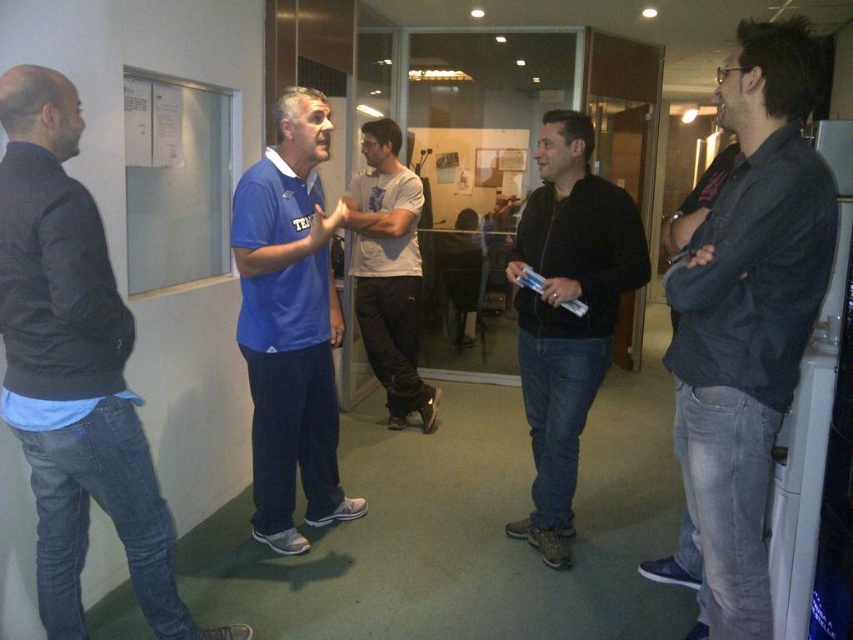
Who is more forward, (x=19, y=300) or (x=628, y=212)?

Point (x=19, y=300)

Does point (16, 422) come farther from viewer compared to point (585, 221)?

That is False.

Where is `dark blue jeans at left`? This screenshot has width=853, height=640. dark blue jeans at left is located at coordinates (74, 369).

The image size is (853, 640). Describe the element at coordinates (747, 317) in the screenshot. I see `dark gray denim jeans at right` at that location.

Find the location of a particular element. Image resolution: width=853 pixels, height=640 pixels. dark gray denim jeans at right is located at coordinates (747, 317).

Which of these two, dark gray denim jeans at right or black matte jacket at center, stands taller?

dark gray denim jeans at right

How much distance is there between dark gray denim jeans at right and black matte jacket at center?

dark gray denim jeans at right is 28.55 inches away from black matte jacket at center.

Is point (698, 472) positioned behind point (566, 298)?

That is False.

Find the location of a particular element. The width and height of the screenshot is (853, 640). dark gray denim jeans at right is located at coordinates (747, 317).